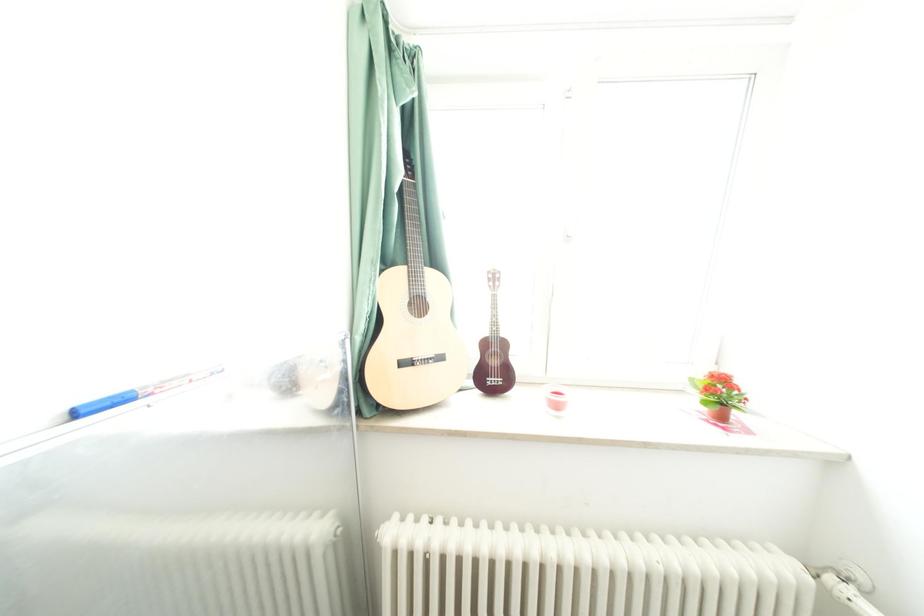
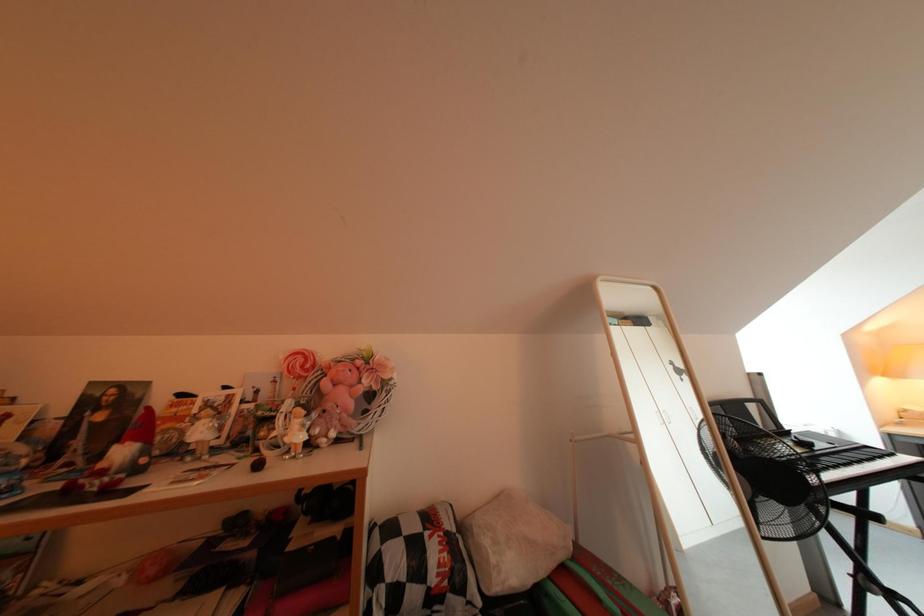
From the picture: Which direction would the cameraman need to move to produce the second image?

The cameraman moved toward left, backward.